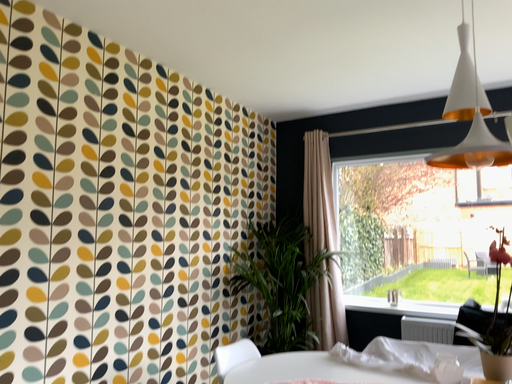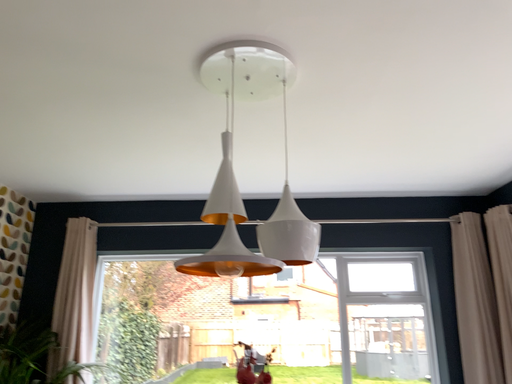
Question: How did the camera likely rotate when shooting the video?

Choices:
 (A) rotated downward
 (B) rotated upward

Answer: (B)